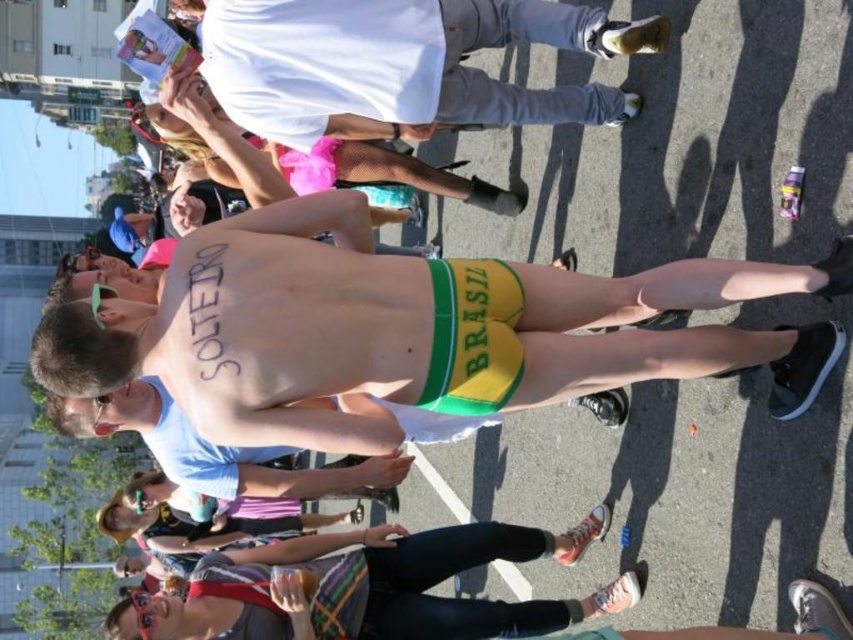
Question: Is white matte shirt at upper center thinner than matte blue shirt at center?

Choices:
 (A) no
 (B) yes

Answer: (A)

Question: Which of the following is the farthest from the observer?

Choices:
 (A) (577, 368)
 (B) (619, 92)
 (C) (219, 134)

Answer: (B)

Question: Which point is farther to the camera?

Choices:
 (A) yellow-green fabric shorts at center
 (B) matte blue shirt at center

Answer: (B)

Question: Does green/yellow fabric shorts at center appear on the left side of matte blue shirt at center?

Choices:
 (A) no
 (B) yes

Answer: (B)

Question: Estimate the real-world distances between objects in this image. Which object is closer to the matte blue shirt at center?

Choices:
 (A) green/yellow fabric shorts at center
 (B) yellow-green fabric shorts at center

Answer: (B)

Question: Is yellow-green fabric shorts at center further to camera compared to green/yellow fabric shorts at center?

Choices:
 (A) no
 (B) yes

Answer: (A)